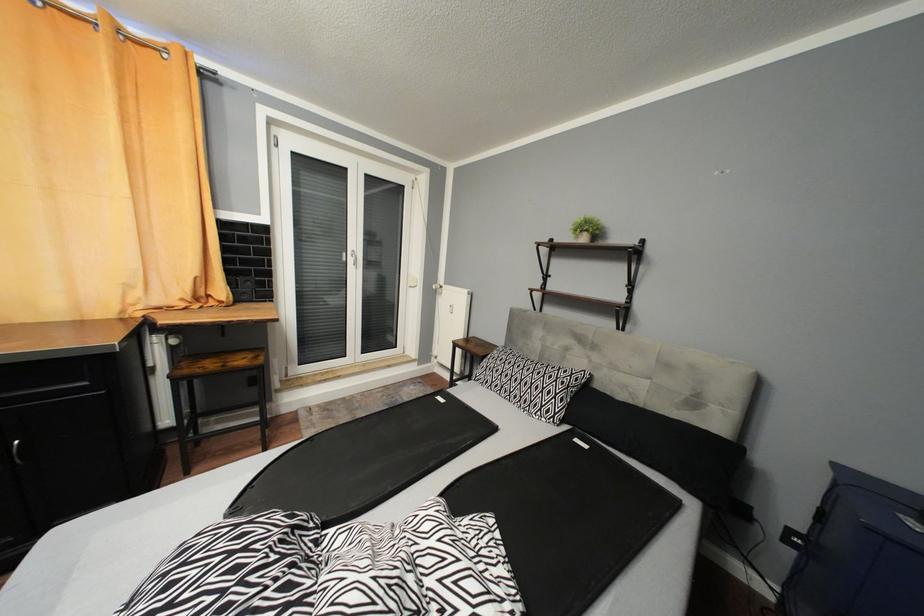
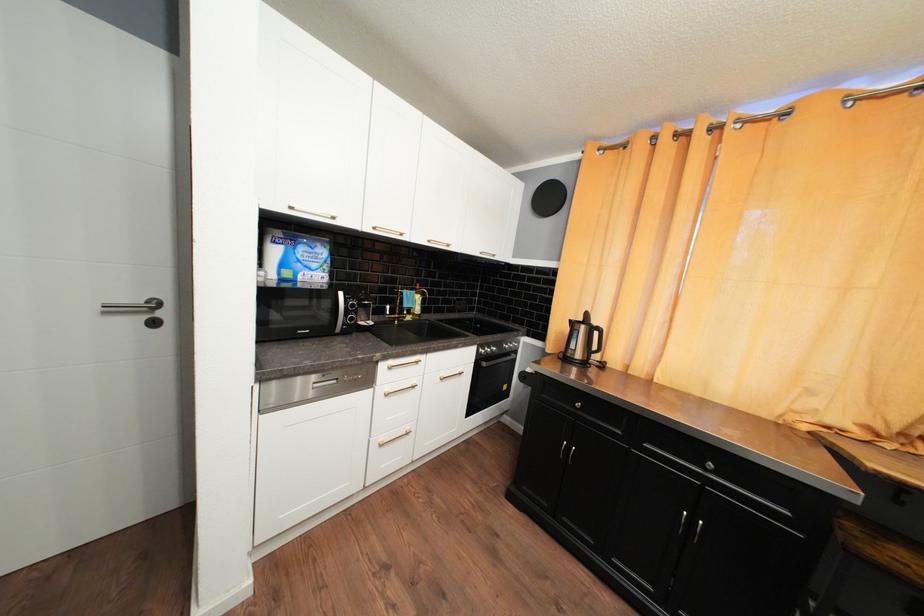
Question: The camera is either moving clockwise (left) or counter-clockwise (right) around the object. The first image is from the beginning of the video and the second image is from the end. Is the camera moving left or right when shooting the video?

Choices:
 (A) Left
 (B) Right

Answer: (B)